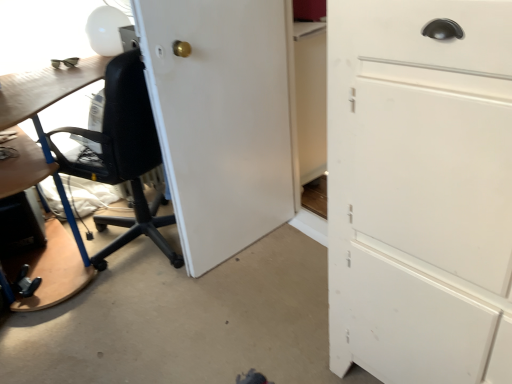
Image resolution: width=512 pixels, height=384 pixels. I want to click on black mesh chair at left, so click(x=123, y=155).

Where is `white matte door at center`? This screenshot has width=512, height=384. white matte door at center is located at coordinates (220, 119).

Is white matte door at center further to camera compared to white matte cabinet at right?

Yes.

In the scene shown: Are white matte door at center and white matte cabinet at right located far from each other?

white matte door at center is actually quite close to white matte cabinet at right.

Based on the photo, from a real-world perspective, is white matte door at center on white matte cabinet at right?

No.

Is white matte door at center inside the boundaries of white matte cabinet at right, or outside?

The correct answer is: outside.

From a real-world perspective, who is located higher, white matte door at center or black mesh chair at left?

In real-world perspective, white matte door at center is above.

From the image's perspective, which object appears higher, white matte door at center or black mesh chair at left?

white matte door at center appears higher in the image.

Does white matte door at center have a lesser height compared to black mesh chair at left?

No, white matte door at center is not shorter than black mesh chair at left.

What's the angular difference between black mesh chair at left and white matte door at center's facing directions?

black mesh chair at left and white matte door at center are facing 163 degrees away from each other.

Does black mesh chair at left have a greater width compared to white matte door at center?

Yes, black mesh chair at left is wider than white matte door at center.

From the image's perspective, which is below, black mesh chair at left or white matte door at center?

black mesh chair at left, from the image's perspective.

Is white glossy table lamp at upper left looking in the opposite direction of white matte door at center?

white glossy table lamp at upper left is not turned away from white matte door at center.

Does white glossy table lamp at upper left come in front of white matte door at center?

No, white glossy table lamp at upper left is further to the viewer.

From the picture: Which object is positioned more to the left, white glossy table lamp at upper left or white matte door at center?

From the viewer's perspective, white glossy table lamp at upper left appears more on the left side.

Can you confirm if white glossy table lamp at upper left is wider than white matte door at center?

Indeed, white glossy table lamp at upper left has a greater width compared to white matte door at center.

From the image's perspective, which is below, white glossy table lamp at upper left or white matte cabinet at right?

white matte cabinet at right appears lower in the image.

Locate an element on the screen. The height and width of the screenshot is (384, 512). cabinetry lying on the right of white glossy table lamp at upper left is located at coordinates (420, 190).

Looking at this image, between white glossy table lamp at upper left and white matte cabinet at right, which one is positioned in front?

white matte cabinet at right is more forward.

Which is in front, point (102, 35) or point (405, 303)?

Point (405, 303)

Is black mesh chair at left smaller than white glossy table lamp at upper left?

No, black mesh chair at left is not smaller than white glossy table lamp at upper left.

In terms of width, does black mesh chair at left look wider or thinner when compared to white glossy table lamp at upper left?

Clearly, black mesh chair at left has more width compared to white glossy table lamp at upper left.

From a real-world perspective, is black mesh chair at left physically located above or below white glossy table lamp at upper left?

In terms of real-world spatial position, black mesh chair at left is below white glossy table lamp at upper left.

Who is shorter, white matte cabinet at right or white glossy table lamp at upper left?

Standing shorter between the two is white glossy table lamp at upper left.

From the image's perspective, is white matte cabinet at right above or below white glossy table lamp at upper left?

white matte cabinet at right is below white glossy table lamp at upper left.

Where is `door located behind the white matte cabinet at right`? The height and width of the screenshot is (384, 512). door located behind the white matte cabinet at right is located at coordinates (220, 119).

This screenshot has width=512, height=384. In order to click on chair that is on the left side of white matte door at center in this screenshot , I will do `click(123, 155)`.

From the image, which object appears to be nearer to white glossy table lamp at upper left, white matte cabinet at right or black mesh chair at left?

black mesh chair at left.

Estimate the real-world distances between objects in this image. Which object is closer to black mesh chair at left, white matte door at center or white glossy table lamp at upper left?

white matte door at center.

Considering their positions, is black mesh chair at left positioned closer to white glossy table lamp at upper left than white matte cabinet at right?

black mesh chair at left is closer to white glossy table lamp at upper left.

From the image, which object appears to be farther from white matte cabinet at right, white glossy table lamp at upper left or white matte door at center?

Based on the image, white glossy table lamp at upper left appears to be further to white matte cabinet at right.

Estimate the real-world distances between objects in this image. Which object is further from white glossy table lamp at upper left, white matte cabinet at right or white matte door at center?

Among the two, white matte cabinet at right is located further to white glossy table lamp at upper left.

Looking at this image, considering their positions, is black mesh chair at left positioned further to white matte door at center than white matte cabinet at right?

white matte cabinet at right is positioned further to the anchor white matte door at center.

Estimate the real-world distances between objects in this image. Which object is further from white glossy table lamp at upper left, black mesh chair at left or white matte door at center?

Among the two, white matte door at center is located further to white glossy table lamp at upper left.

Considering their positions, is white matte cabinet at right positioned closer to black mesh chair at left than white glossy table lamp at upper left?

Among the two, white glossy table lamp at upper left is located nearer to black mesh chair at left.

You are a GUI agent. You are given a task and a screenshot of the screen. Output one action in this format:
    pyautogui.click(x=<x>, y=<y>)
    Task: Click on the door between white matte cabinet at right and white glossy table lamp at upper left along the z-axis
    
    Given the screenshot: What is the action you would take?
    pyautogui.click(x=220, y=119)

At what (x,y) coordinates should I click in order to perform the action: click on chair between white matte door at center and white glossy table lamp at upper left from front to back. Please return your answer as a coordinate pair (x, y). Image resolution: width=512 pixels, height=384 pixels. Looking at the image, I should click on coord(123,155).

Locate an element on the screen. chair between white matte cabinet at right and white glossy table lamp at upper left from front to back is located at coordinates (123, 155).

Locate an element on the screen. This screenshot has height=384, width=512. door situated between black mesh chair at left and white matte cabinet at right from left to right is located at coordinates (220, 119).